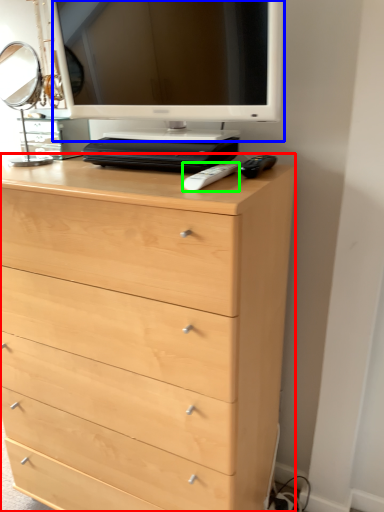
Question: Which is nearer to the chest of drawers (highlighted by a red box)? computer monitor (highlighted by a blue box) or remote (highlighted by a green box).

Choices:
 (A) computer monitor
 (B) remote

Answer: (A)